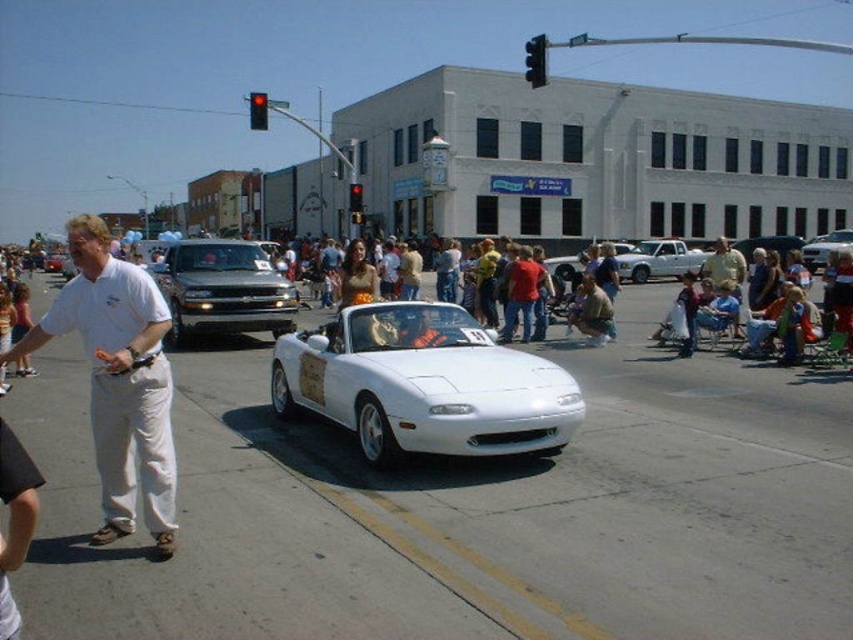
You are a delivery driver who needs to pass under the red plastic traffic light at upper center with your matte black truck at center. Can your truck clear the height required to pass under the traffic light without hitting it?

The matte black truck at center is shorter than the red plastic traffic light at upper center, so the truck can safely pass under the traffic light without hitting it.